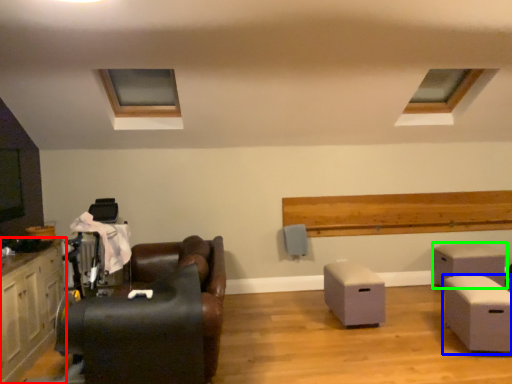
Question: Considering the real-world distances, which object is farthest from cabinetry (highlighted by a red box)? table (highlighted by a blue box) or table (highlighted by a green box)?

Choices:
 (A) table
 (B) table

Answer: (B)